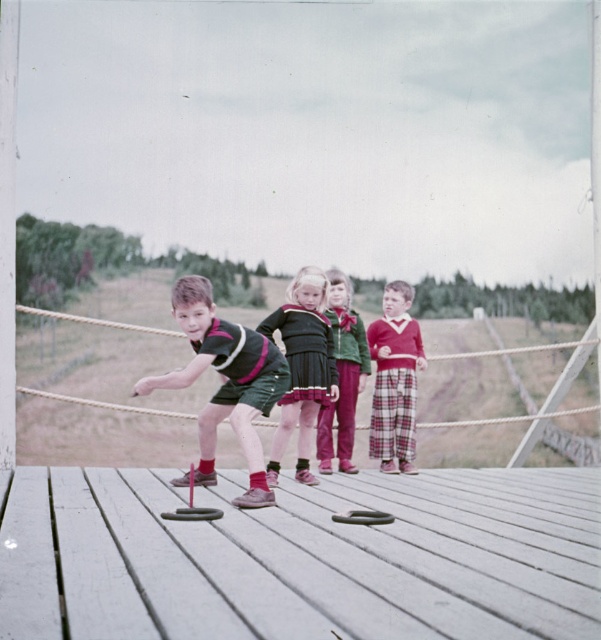
You are a photographer standing at the edge of the deck. You want to take a picture that includes both the matte black dress at center and the velvet green sweater at center. What is the minimum distance you need to move backward to ensure both objects are fully visible in your camera frame?

The matte black dress at center is 32.46 inches from the velvet green sweater at center. To capture both in the frame, you need to move back at least 32.46 inches to account for the distance between them.

From the picture: You are a photographer trying to capture a photo of the children playing with rings and a stick on the wooden deck. You notice two children wearing a matte black dress at center and a velvet green sweater at center. Which child should you focus on if you want to photograph someone whose clothing is shorter in length?

The matte black dress at center is shorter than the velvet green sweater at center, so you should focus on the child wearing the matte black dress at center for a shorter length garment.